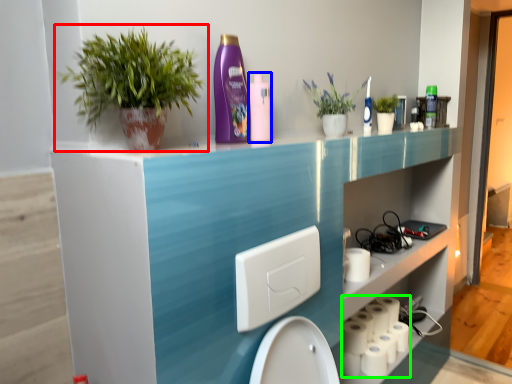
Question: Which object is the closest to the houseplant (highlighted by a red box)? Choose among these: cleaning product (highlighted by a blue box) or toilet paper (highlighted by a green box).

Choices:
 (A) cleaning product
 (B) toilet paper

Answer: (A)